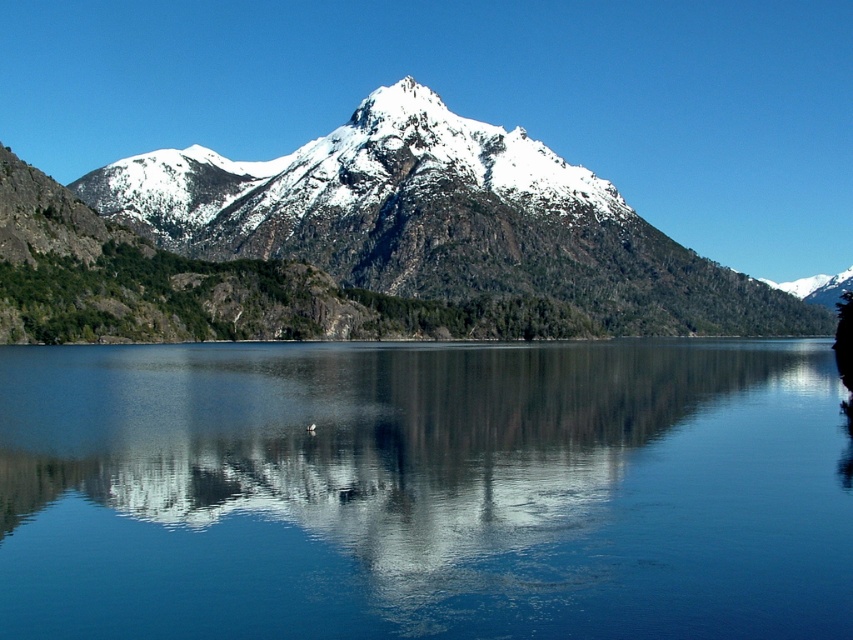
Image resolution: width=853 pixels, height=640 pixels. What do you see at coordinates (425, 490) in the screenshot?
I see `smooth blue water at center` at bounding box center [425, 490].

Who is taller, smooth blue water at center or snowy rocky mountain at center?

snowy rocky mountain at center

The width and height of the screenshot is (853, 640). I want to click on smooth blue water at center, so click(425, 490).